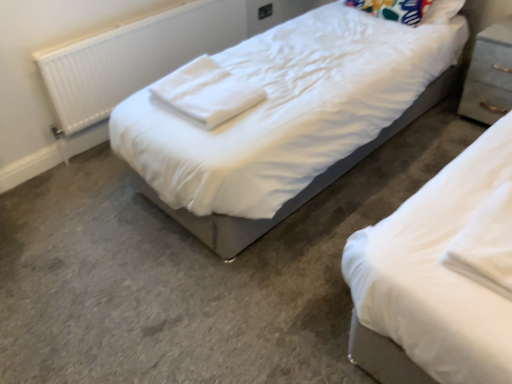
Question: Is multicolored fabric pillow at upper right situated inside white cotton cloth at center or outside?

Choices:
 (A) inside
 (B) outside

Answer: (B)

Question: From a real-world perspective, is multicolored fabric pillow at upper right above or below white cotton cloth at center?

Choices:
 (A) above
 (B) below

Answer: (B)

Question: Considering the real-world distances, which object is farthest from the white plastic radiator at left?

Choices:
 (A) white cotton cloth at center
 (B) multicolored fabric pillow at upper right
 (C) light gray wood nightstand at right

Answer: (C)

Question: Which object is the farthest from the multicolored fabric pillow at upper right?

Choices:
 (A) light gray wood nightstand at right
 (B) white plastic radiator at left
 (C) white cotton cloth at center

Answer: (B)